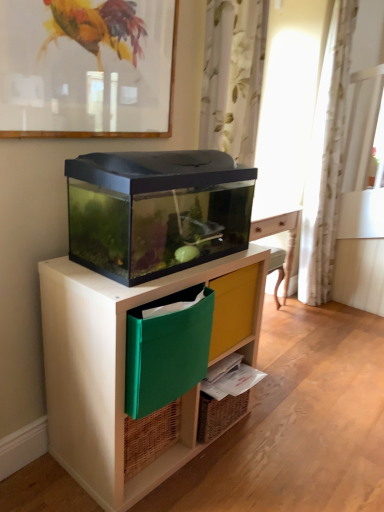
Question: Can you confirm if white floral fabric curtain at upper center, which is counted as the 2th curtain, starting from the right, is thinner than matte glass picture frame at upper center?

Choices:
 (A) yes
 (B) no

Answer: (B)

Question: Is white floral fabric curtain at upper center, which is counted as the 2th curtain, starting from the right, looking in the opposite direction of matte glass picture frame at upper center?

Choices:
 (A) yes
 (B) no

Answer: (B)

Question: From the image's perspective, is white floral fabric curtain at upper center, the first curtain when ordered from front to back, below matte glass picture frame at upper center?

Choices:
 (A) yes
 (B) no

Answer: (A)

Question: Can you confirm if white floral fabric curtain at upper center, which is counted as the 1th curtain, starting from the left, is shorter than matte glass picture frame at upper center?

Choices:
 (A) no
 (B) yes

Answer: (A)

Question: Is white floral fabric curtain at upper center, which is counted as the 1th curtain, starting from the left, positioned in front of matte glass picture frame at upper center?

Choices:
 (A) no
 (B) yes

Answer: (A)

Question: Would you say white floral fabric curtain at upper center, which is counted as the 1th curtain, starting from the left, contains matte glass picture frame at upper center?

Choices:
 (A) yes
 (B) no

Answer: (B)

Question: Is matte glass picture frame at upper center positioned beyond the bounds of white floral fabric curtain at upper center, which is counted as the 1th curtain, starting from the left?

Choices:
 (A) no
 (B) yes

Answer: (B)

Question: Is matte glass picture frame at upper center wider than white floral fabric curtain at upper center, the second curtain from the back?

Choices:
 (A) yes
 (B) no

Answer: (B)

Question: From the image's perspective, does matte glass picture frame at upper center appear lower than white floral fabric curtain at upper center, which is counted as the 1th curtain, starting from the left?

Choices:
 (A) yes
 (B) no

Answer: (B)

Question: Is matte glass picture frame at upper center closer to camera compared to white floral fabric curtain at upper center, the first curtain when ordered from front to back?

Choices:
 (A) no
 (B) yes

Answer: (B)

Question: Considering the relative positions of matte glass picture frame at upper center and white floral fabric curtain at upper center, which is counted as the 2th curtain, starting from the right, in the image provided, is matte glass picture frame at upper center behind white floral fabric curtain at upper center, which is counted as the 2th curtain, starting from the right,?

Choices:
 (A) yes
 (B) no

Answer: (B)

Question: From a real-world perspective, is matte glass picture frame at upper center over white floral fabric curtain at upper center, the second curtain from the back?

Choices:
 (A) yes
 (B) no

Answer: (A)

Question: Is white floral fabric curtain at upper center, the first curtain when ordered from front to back, outside of matte black aquarium at center?

Choices:
 (A) no
 (B) yes

Answer: (B)